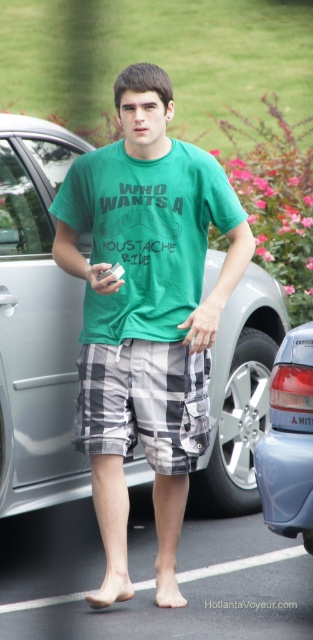
Question: Is silver metallic car at center below green cotton t-shirt at center?

Choices:
 (A) no
 (B) yes

Answer: (B)

Question: Considering the relative positions of silver metallic car at center and blue metallic sedan at right in the image provided, where is silver metallic car at center located with respect to blue metallic sedan at right?

Choices:
 (A) left
 (B) right

Answer: (A)

Question: Does silver metallic car at center appear under blue metallic sedan at right?

Choices:
 (A) no
 (B) yes

Answer: (A)

Question: Which of the following is the farthest from the observer?

Choices:
 (A) green cotton t-shirt at center
 (B) plaid cotton shorts at center

Answer: (A)

Question: Which object appears closest to the camera in this image?

Choices:
 (A) green cotton t-shirt at center
 (B) blue metallic sedan at right
 (C) plaid cotton shorts at center

Answer: (B)

Question: Which of these objects is positioned closest to the silver metallic car at center?

Choices:
 (A) green cotton t-shirt at center
 (B) blue metallic sedan at right
 (C) plaid cotton shorts at center

Answer: (C)